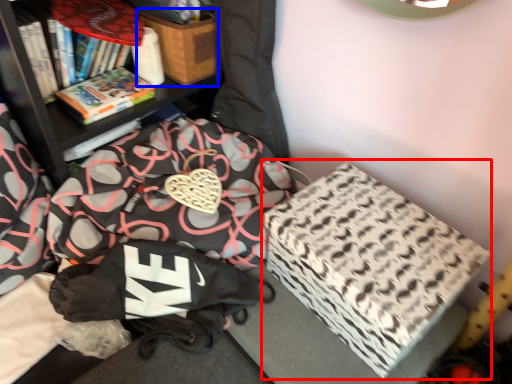
Question: Which object appears closest to the camera in this image, cardboard box (highlighted by a red box) or cardboard box (highlighted by a blue box)?

Choices:
 (A) cardboard box
 (B) cardboard box

Answer: (A)